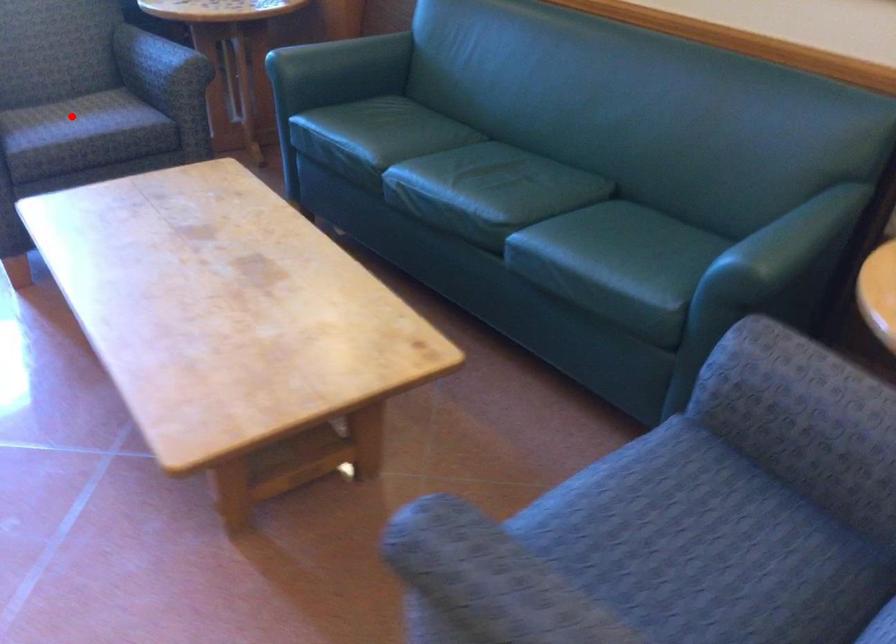
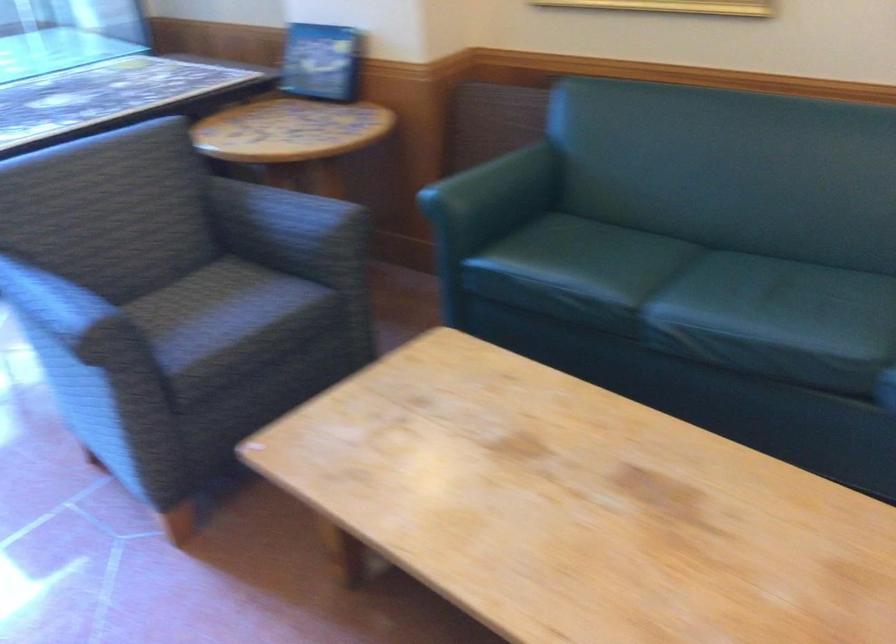
Where in the second image is the point corresponding to the highlighted location from the first image?

(224, 317)